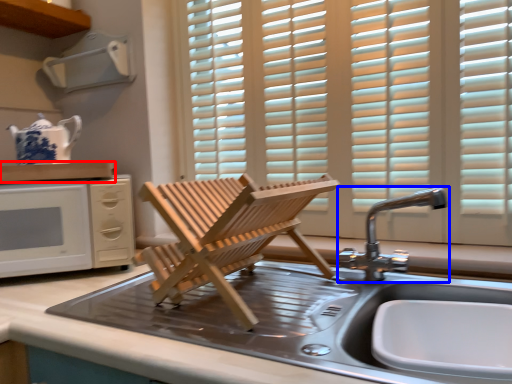
Question: Which of the following is the farthest to the observer, countertop (highlighted by a red box) or tap (highlighted by a blue box)?

Choices:
 (A) countertop
 (B) tap

Answer: (A)